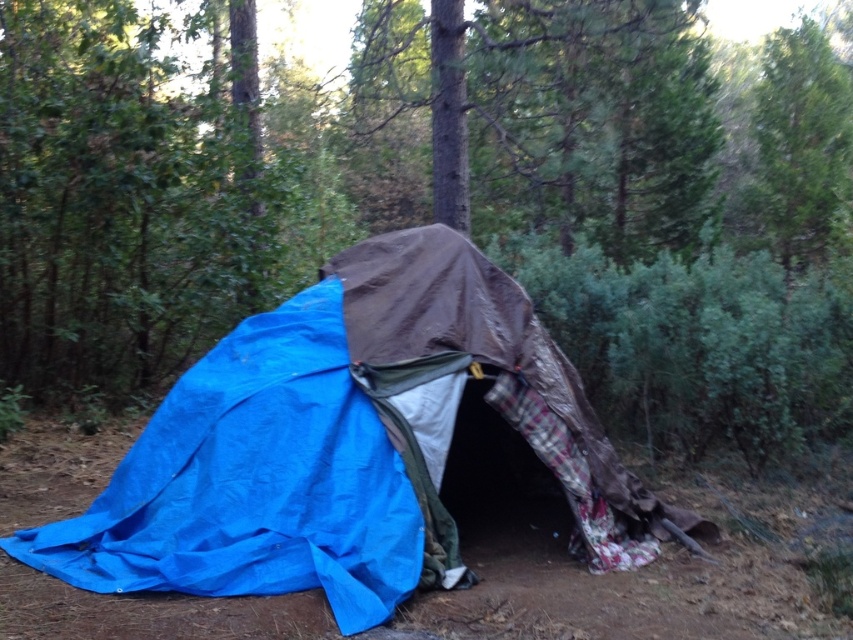
Does blue tarp at center come in front of green leafy tree at upper right?

Yes, it is.

You are a GUI agent. You are given a task and a screenshot of the screen. Output one action in this format:
    pyautogui.click(x=<x>, y=<y>)
    Task: Click on the blue tarp at center
    This screenshot has width=853, height=640.
    Given the screenshot: What is the action you would take?
    pyautogui.click(x=349, y=444)

I want to click on blue tarp at center, so click(x=349, y=444).